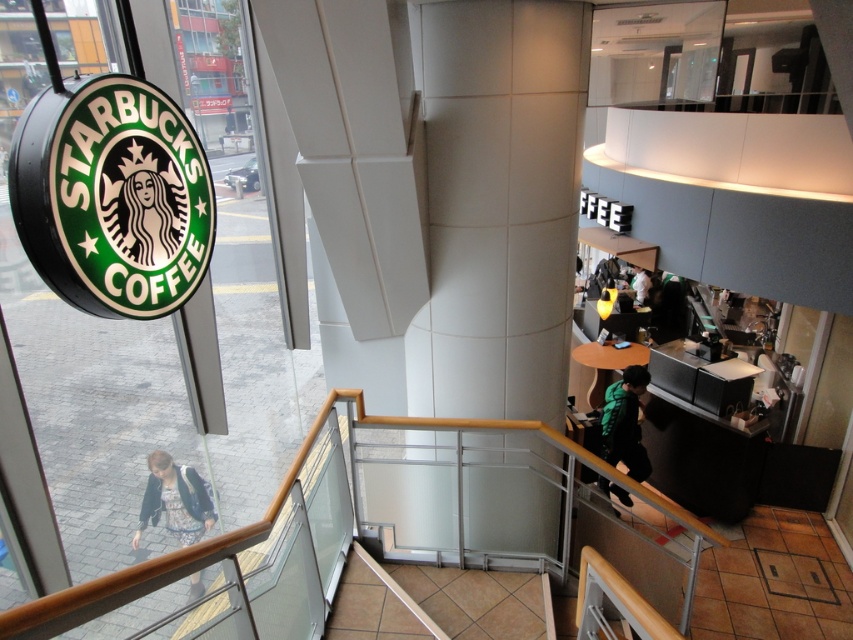
You are a customer standing at the entrance of the Starbucks coffee shop. You notice the white tile pillar at center and the denim jacket at lower left. Which object is positioned higher from the floor?

The white tile pillar at center is located above the denim jacket at lower left, so it is positioned higher from the floor.

You are standing at the entrance of the Starbucks coffee shop and want to go to the counter. The white tile pillar at center is in your way. Can you walk around it to reach the counter?

The white tile pillar at center is located at point (498,204), so yes, you can walk around it to reach the counter.